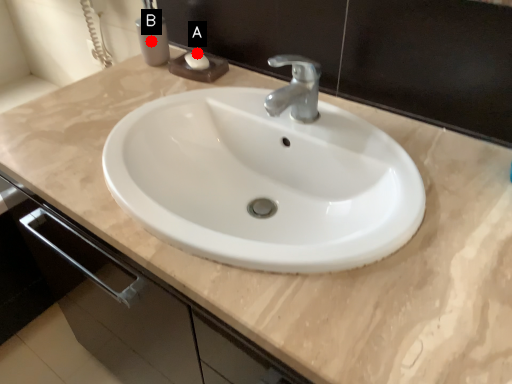
Question: Two points are circled on the image, labeled by A and B beside each circle. Which point is closer to the camera?

Choices:
 (A) A is closer
 (B) B is closer

Answer: (B)